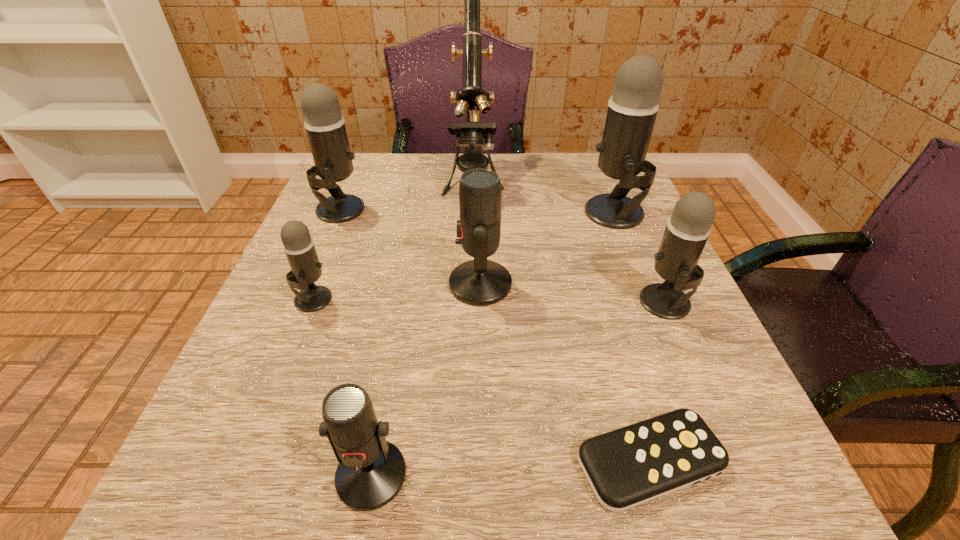
This screenshot has width=960, height=540. I want to click on free spot located on the back of the remote control, so click(x=619, y=357).

What are the coordinates of `microscope that is at the far edge` in the screenshot? It's located at (472, 96).

Where is `microphone that is at the near edge`? microphone that is at the near edge is located at coordinates (371, 471).

Locate an element on the screen. This screenshot has width=960, height=540. remote control located in the near edge section of the desktop is located at coordinates (626, 467).

The image size is (960, 540). In order to click on remote control that is positioned at the right edge in this screenshot , I will do `click(626, 467)`.

This screenshot has width=960, height=540. Identify the location of object that is at the far left corner. (325, 126).

The height and width of the screenshot is (540, 960). What are the coordinates of `object situated at the far right corner` in the screenshot? It's located at (632, 109).

At what (x,y) coordinates should I click in order to perform the action: click on object that is at the near right corner. Please return your answer as a coordinate pair (x, y). This screenshot has width=960, height=540. Looking at the image, I should click on (626, 467).

Find the location of `vacant area at the far edge`. vacant area at the far edge is located at coordinates (437, 154).

Locate an element on the screen. This screenshot has width=960, height=540. free spot at the left edge of the desktop is located at coordinates (347, 241).